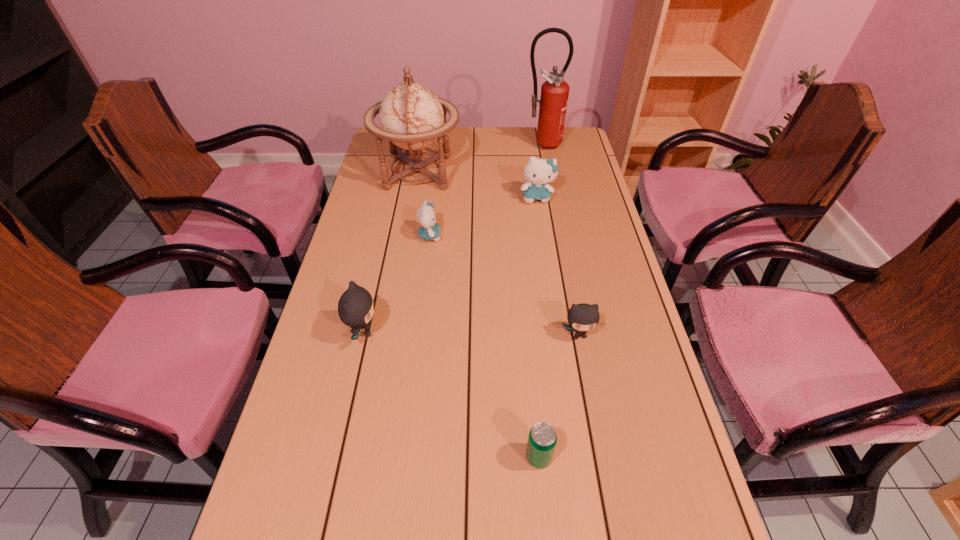
Identify the location of vacant space that satisfies the following two spatial constraints: 1. on the face of the nearest object; 2. on the right side of the third kitten from right to left. (403, 457).